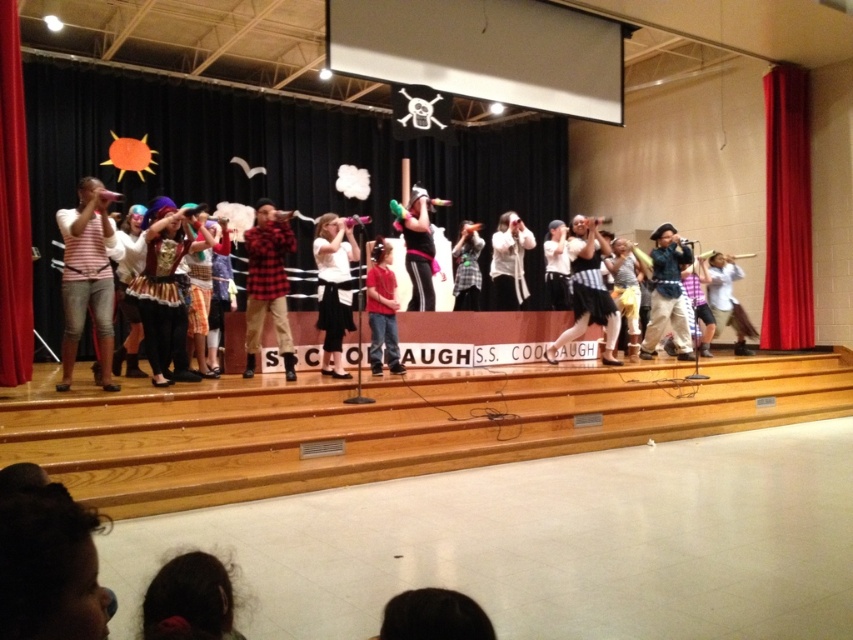
Question: Is the position of white striped skirt at center less distant than that of white plaid skirt at center?

Choices:
 (A) yes
 (B) no

Answer: (A)

Question: Among these objects, which one is nearest to the camera?

Choices:
 (A) yellow fabric pants at center
 (B) dark brown hair at lower center
 (C) blue denim jeans at center
 (D) white plaid skirt at center

Answer: (B)

Question: Is white matte shirt at center to the right of yellow fabric pants at center from the viewer's perspective?

Choices:
 (A) yes
 (B) no

Answer: (B)

Question: Which of the following is the farthest from the observer?

Choices:
 (A) (276, 260)
 (B) (688, 289)

Answer: (B)

Question: In this image, where is red plaid shirt at center located relative to white matte skirt at center?

Choices:
 (A) above
 (B) below

Answer: (A)

Question: Estimate the real-world distances between objects in this image. Which object is farther from the blue jeans at center?

Choices:
 (A) red plaid shirt at center
 (B) white plaid skirt at center
 (C) white matte skirt at center

Answer: (B)